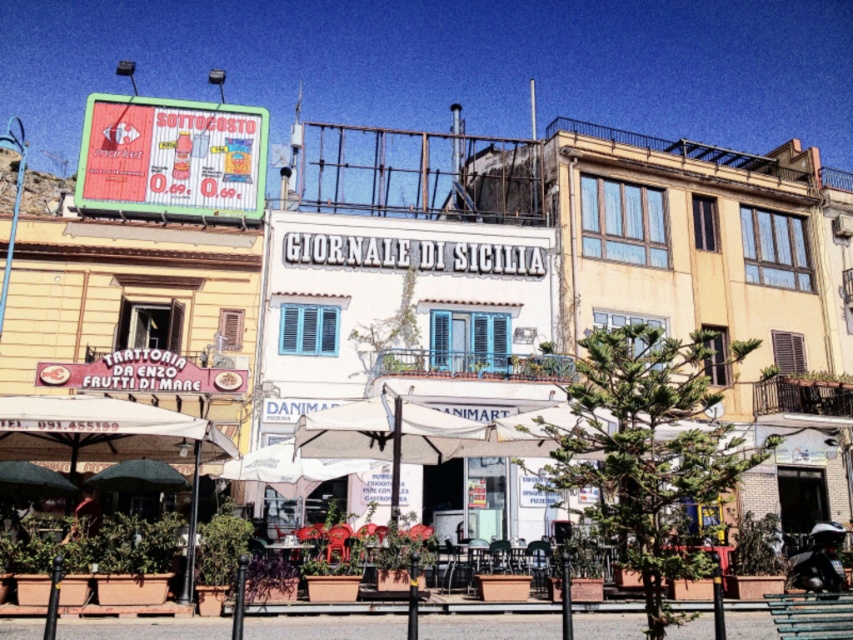
You are a painter standing in the middle of the street. You want to paint both the green painted wood park bench at lower right and the green fabric umbrella at lower left. Which object should you paint first if you want to start with the taller one?

The green painted wood park bench at lower right is taller than the green fabric umbrella at lower left, so you should paint the green painted wood park bench at lower right first.

You are a tourist visiting the town and want to sit in a shaded area. You see the green painted wood park bench at lower right and the green fabric umbrella at lower left. Which object would provide more shade coverage?

The green painted wood park bench at lower right has a larger size compared to the green fabric umbrella at lower left, so it would provide more shade coverage.

In the scene shown: You are a tourist visiting the Mediterranean town and want to sit in the shade. You see the green painted wood park bench at lower right and the green fabric umbrella at lower left. Which object provides shade for the bench?

The green fabric umbrella at lower left provides shade for the green painted wood park bench at lower right because the bench is positioned under the umbrella.